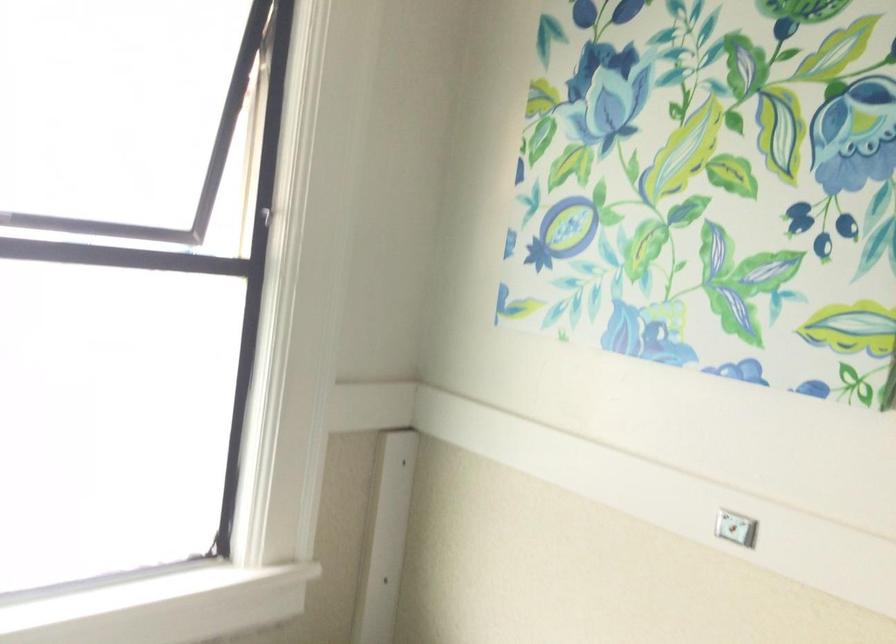
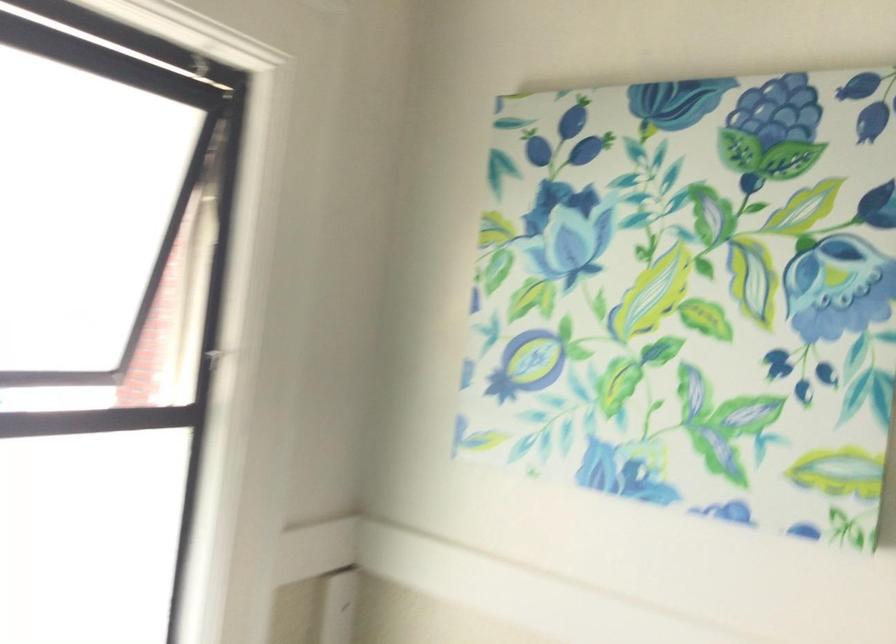
Question: How did the camera likely rotate?

Choices:
 (A) Left
 (B) Right
 (C) Up
 (D) Down

Answer: (B)